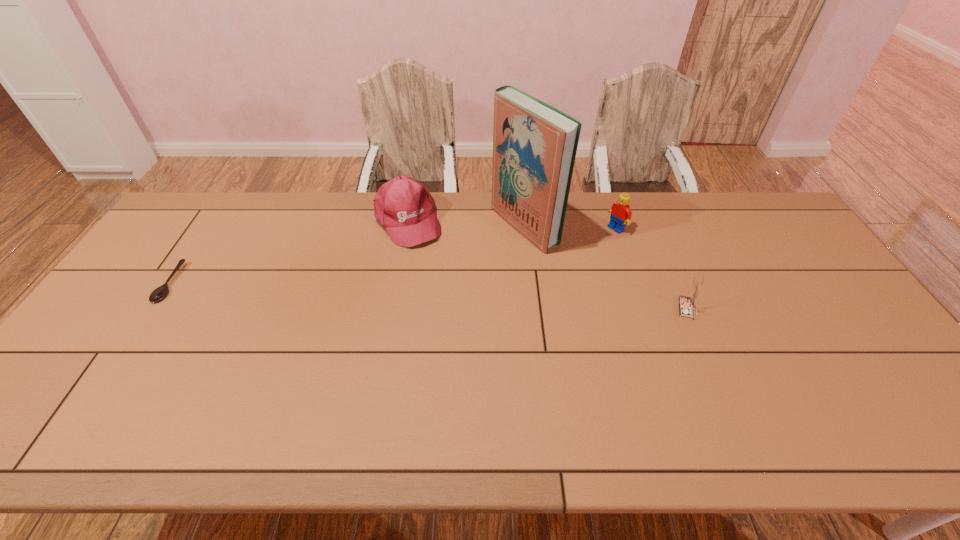
The height and width of the screenshot is (540, 960). What are the coordinates of `free point between the Lego and the tallest object` in the screenshot? It's located at (570, 227).

Identify the location of free space between the shortest object and the third object from right to left. The height and width of the screenshot is (540, 960). (347, 254).

Identify the location of unoccupied position between the matchbox and the Lego. Image resolution: width=960 pixels, height=540 pixels. (651, 268).

Find the location of a particular element. unoccupied area between the Lego and the leftmost object is located at coordinates (393, 255).

You are a GUI agent. You are given a task and a screenshot of the screen. Output one action in this format:
    pyautogui.click(x=<x>, y=<y>)
    Task: Click on the vacant space that is in between the fourth object from right to left and the soupspoon
    The width and height of the screenshot is (960, 540).
    Given the screenshot: What is the action you would take?
    pyautogui.click(x=288, y=252)

The image size is (960, 540). Find the location of `free space between the matchbox and the second object from left to right`. free space between the matchbox and the second object from left to right is located at coordinates coord(546,265).

Select which object appears as the fourth closest to the baseball cap. Please provide its 2D coordinates. Your answer should be formatted as a tuple, i.e. [(x, y)], where the tuple contains the x and y coordinates of a point satisfying the conditions above.

[(686, 304)]

Where is `object that stands as the third closest to the third object from left to right`? The width and height of the screenshot is (960, 540). object that stands as the third closest to the third object from left to right is located at coordinates (686, 304).

Find the location of a particular element. The height and width of the screenshot is (540, 960). vacant region that satisfies the following two spatial constraints: 1. on the front side of the second object from right to left; 2. on the left side of the rightmost object is located at coordinates (642, 309).

I want to click on vacant space that satisfies the following two spatial constraints: 1. on the front side of the matchbox; 2. on the left side of the second object from right to left, so click(x=642, y=309).